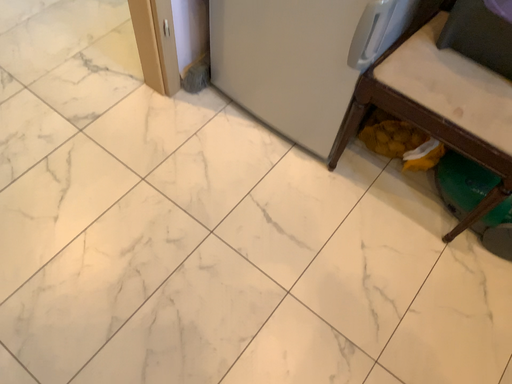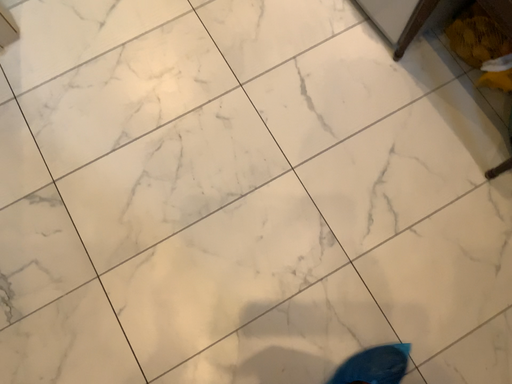
Question: How did the camera likely rotate when shooting the video?

Choices:
 (A) rotated upward
 (B) rotated downward

Answer: (B)